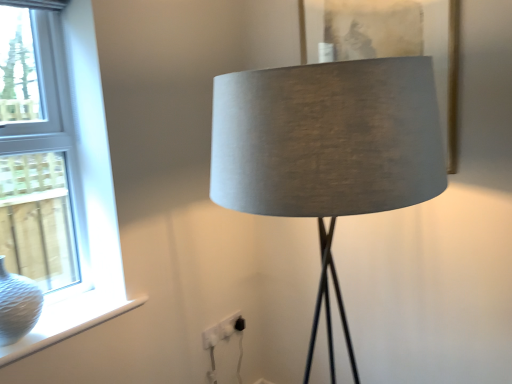
Measure the distance between point [301,3] and camera.

Point [301,3] and camera are 5.56 feet apart from each other.

Where is `matte gray fabric picture frame at center`? matte gray fabric picture frame at center is located at coordinates (390, 41).

Find the location of a particular element. The height and width of the screenshot is (384, 512). matte gray fabric picture frame at center is located at coordinates (390, 41).

Considering the relative sizes of white glass window at left and white textured glass vase at left in the image provided, is white glass window at left smaller than white textured glass vase at left?

No.

The width and height of the screenshot is (512, 384). Find the location of `window that appears in front of the white textured glass vase at left`. window that appears in front of the white textured glass vase at left is located at coordinates (61, 186).

From the image's perspective, which one is positioned higher, white glass window at left or white textured glass vase at left?

white glass window at left appears higher in the image.

Which point is more distant from viewer, (60, 19) or (35, 290)?

The point (60, 19) is more distant.

Could you tell me if matte gray fabric picture frame at center is turned towards white textured glass vase at left?

Yes.

Would you consider matte gray fabric picture frame at center to be distant from white textured glass vase at left?

Yes, matte gray fabric picture frame at center and white textured glass vase at left are quite far apart.

Between point (345, 32) and point (30, 289), which one is positioned in front?

The point (30, 289) is closer.

From the picture: From a real-world perspective, which object rests below the other?

white textured glass vase at left is physically lower.

Which point is more forward, (61, 331) or (252, 83)?

The point (252, 83) is more forward.

In the image, there is a white glass window at left. At what (x,y) coordinates should I click in order to perform the action: click on lamp below it (from a real-world perspective). Please return your answer as a coordinate pair (x, y). Looking at the image, I should click on (x=327, y=149).

From the image's perspective, which one is positioned lower, white glass window at left or satin grey lampshade at center?

satin grey lampshade at center appears lower in the image.

From the image's perspective, is matte gray fabric picture frame at center above or below white glass window at left?

Based on their image positions, matte gray fabric picture frame at center is located above white glass window at left.

How much distance is there between matte gray fabric picture frame at center and white glass window at left?

The distance of matte gray fabric picture frame at center from white glass window at left is 1.01 meters.

Does point (298, 13) come closer to viewer compared to point (3, 250)?

Yes, point (298, 13) is in front of point (3, 250).

In the scene shown: Can we say matte gray fabric picture frame at center lies outside white glass window at left?

Absolutely, matte gray fabric picture frame at center is external to white glass window at left.

Consider the image. Considering the sizes of white textured glass vase at left and satin grey lampshade at center in the image, is white textured glass vase at left bigger or smaller than satin grey lampshade at center?

white textured glass vase at left is smaller than satin grey lampshade at center.

Between point (7, 274) and point (323, 241), which one is positioned in front?

Positioned in front is point (323, 241).

Identify the location of glass vase lying behind the satin grey lampshade at center. (17, 305).

Considering the relative sizes of matte gray fabric picture frame at center and satin grey lampshade at center in the image provided, is matte gray fabric picture frame at center bigger than satin grey lampshade at center?

No, matte gray fabric picture frame at center is not bigger than satin grey lampshade at center.

Is matte gray fabric picture frame at center facing towards satin grey lampshade at center?

Yes.

Is matte gray fabric picture frame at center taller or shorter than satin grey lampshade at center?

In the image, matte gray fabric picture frame at center appears to be shorter than satin grey lampshade at center.

Which is less distant, (447, 151) or (368, 108)?

The point (368, 108) is closer to the camera.

Considering the sizes of white textured vase at lower left and satin grey lampshade at center in the image, is white textured vase at lower left bigger or smaller than satin grey lampshade at center?

In the image, white textured vase at lower left appears to be smaller than satin grey lampshade at center.

Is the position of white textured vase at lower left less distant than that of satin grey lampshade at center?

No, it is not.

Is white textured vase at lower left positioned beyond the bounds of satin grey lampshade at center?

Indeed, white textured vase at lower left is completely outside satin grey lampshade at center.

Locate an element on the screen. The width and height of the screenshot is (512, 384). glass vase on the right of white glass window at left is located at coordinates (17, 305).

At what (x,y) coordinates should I click in order to perform the action: click on glass vase in front of the matte gray fabric picture frame at center. Please return your answer as a coordinate pair (x, y). This screenshot has width=512, height=384. Looking at the image, I should click on (17, 305).

Based on their spatial positions, is white textured vase at lower left or matte gray fabric picture frame at center further from white glass window at left?

matte gray fabric picture frame at center.

Estimate the real-world distances between objects in this image. Which object is closer to white textured glass vase at left, satin grey lampshade at center or matte gray fabric picture frame at center?

satin grey lampshade at center lies closer to white textured glass vase at left than the other object.

Which object lies further to the anchor point white textured glass vase at left, white glass window at left or satin grey lampshade at center?

Among the two, satin grey lampshade at center is located further to white textured glass vase at left.

When comparing their distances from white textured glass vase at left, does satin grey lampshade at center or white textured vase at lower left seem further?

satin grey lampshade at center lies further to white textured glass vase at left than the other object.

Which object lies further to the anchor point white glass window at left, satin grey lampshade at center or matte gray fabric picture frame at center?

Among the two, matte gray fabric picture frame at center is located further to white glass window at left.

Which object lies nearer to the anchor point satin grey lampshade at center, matte gray fabric picture frame at center or white textured vase at lower left?

matte gray fabric picture frame at center.

From the image, which object appears to be nearer to satin grey lampshade at center, white glass window at left or matte gray fabric picture frame at center?

matte gray fabric picture frame at center is positioned closer to the anchor satin grey lampshade at center.

Consider the image. When comparing their distances from satin grey lampshade at center, does white textured vase at lower left or matte gray fabric picture frame at center seem further?

Based on the image, white textured vase at lower left appears to be further to satin grey lampshade at center.

I want to click on window sill located between white textured glass vase at left and satin grey lampshade at center in the left-right direction, so click(69, 321).

The image size is (512, 384). Find the location of `lamp located between white textured glass vase at left and matte gray fabric picture frame at center in the left-right direction`. lamp located between white textured glass vase at left and matte gray fabric picture frame at center in the left-right direction is located at coordinates (327, 149).

This screenshot has width=512, height=384. I want to click on glass vase between white glass window at left and white textured vase at lower left from top to bottom, so click(17, 305).

Locate an element on the screen. The image size is (512, 384). glass vase situated between white glass window at left and matte gray fabric picture frame at center from left to right is located at coordinates (17, 305).